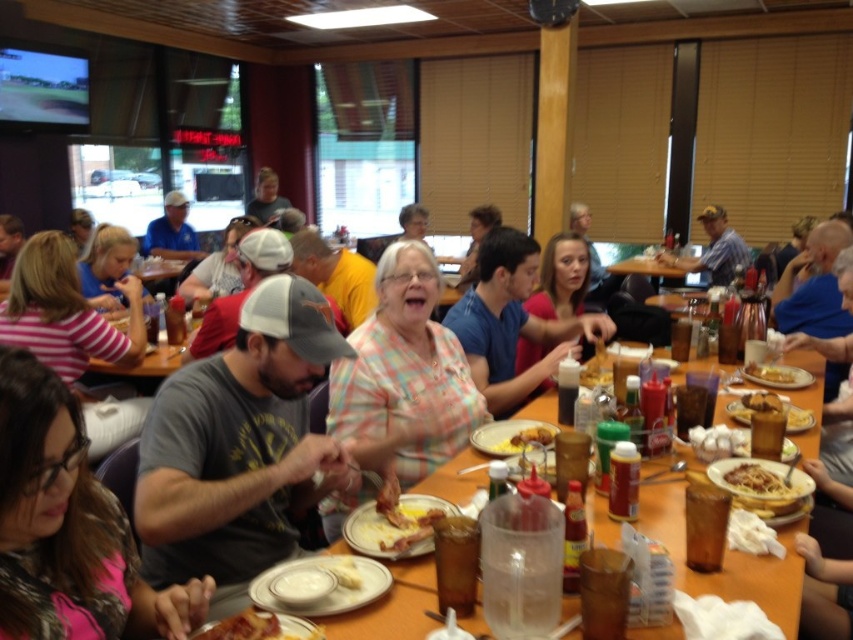
You are a server in a restaurant and need to place a 12 inch wide tray on the wooden table at center. Can you fit the tray on the table without it hanging over the edge? Please consider the shiny brown pasta at center which is already on the table.

Answer: The wooden table at center might be wider than shiny brown pasta at center, so the 12 inch wide tray could potentially fit if the table has enough space. However, the exact dimensions are uncertain based on the provided information. Please check the table size before placing the tray.

You are a server in the restaurant and need to place a new drink order on the table. Considering the height difference between the brown wood table at center and the matte plastic plate at center, where should you place the drink to avoid it being too close to the plate?

The brown wood table at center is taller than the matte plastic plate at center, so placing the drink on the table surface away from the matte plastic plate at center ensures it is not too close to the plate.

You are a server in the restaurant and need to deliver a dessert to the table. The dessert is placed on the wooden table at center. However, there is a shiny brown pasta at center in the way. Can you reach the dessert without moving the pasta?

The wooden table at center is further to the viewer than the shiny brown pasta at center, so the pasta is closer to you. Therefore, you can reach the dessert on the wooden table at center by moving around the pasta since it is in front of the table.